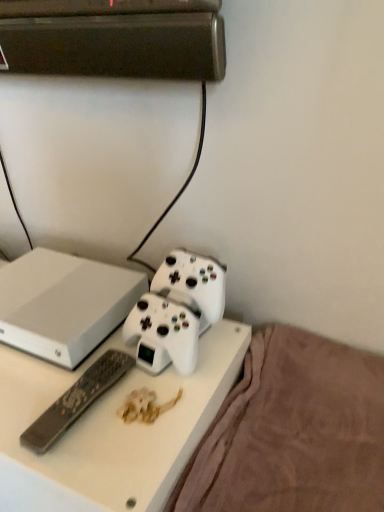
Locate an element on the screen. free location to the left of black plastic remote at lower left is located at coordinates (24, 394).